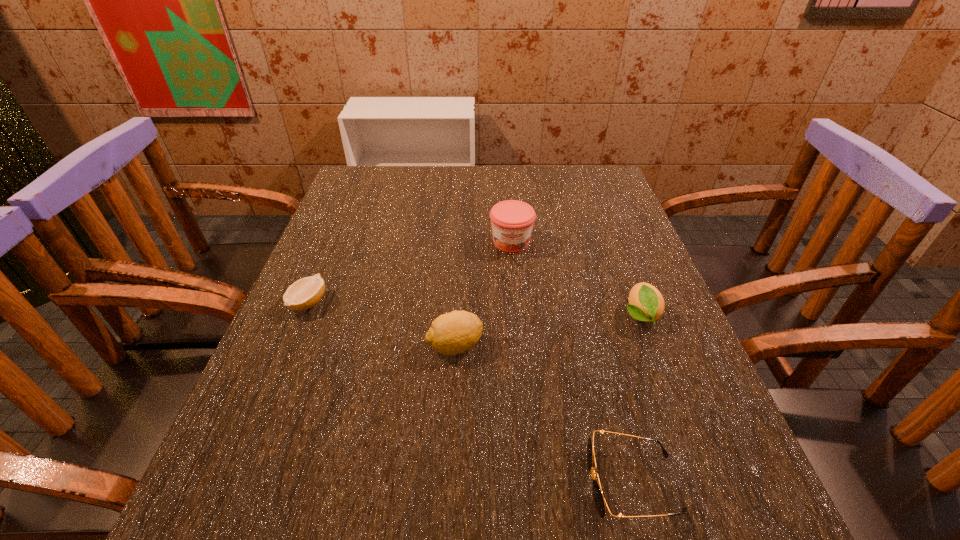
Locate an element on the screen. This screenshot has height=540, width=960. unoccupied area between the rightmost lemon and the tallest object is located at coordinates pyautogui.click(x=576, y=279).

Where is `free space between the sunglasses and the leftmost object`? free space between the sunglasses and the leftmost object is located at coordinates (470, 393).

This screenshot has height=540, width=960. I want to click on free space between the nearest object and the leftmost object, so click(x=470, y=393).

This screenshot has height=540, width=960. Identify the location of empty space between the rightmost lemon and the third object from left to right. (576, 279).

Locate an element on the screen. This screenshot has width=960, height=540. free space between the shortest lemon and the fourth object from left to right is located at coordinates (470, 393).

This screenshot has width=960, height=540. I want to click on free space between the rightmost object and the third object from left to right, so click(576, 279).

Identify which object is located as the second nearest to the second lemon from left to right. Please provide its 2D coordinates. Your answer should be formatted as a tuple, i.e. [(x, y)], where the tuple contains the x and y coordinates of a point satisfying the conditions above.

[(305, 293)]

Find the location of a particular element. This screenshot has width=960, height=540. object that is the fourth closest one to the leftmost object is located at coordinates (646, 303).

Select which lemon is the closest to the second lemon from right to left. Please provide its 2D coordinates. Your answer should be formatted as a tuple, i.e. [(x, y)], where the tuple contains the x and y coordinates of a point satisfying the conditions above.

[(305, 293)]

The image size is (960, 540). I want to click on lemon object that ranks as the second closest to the third object from left to right, so click(452, 333).